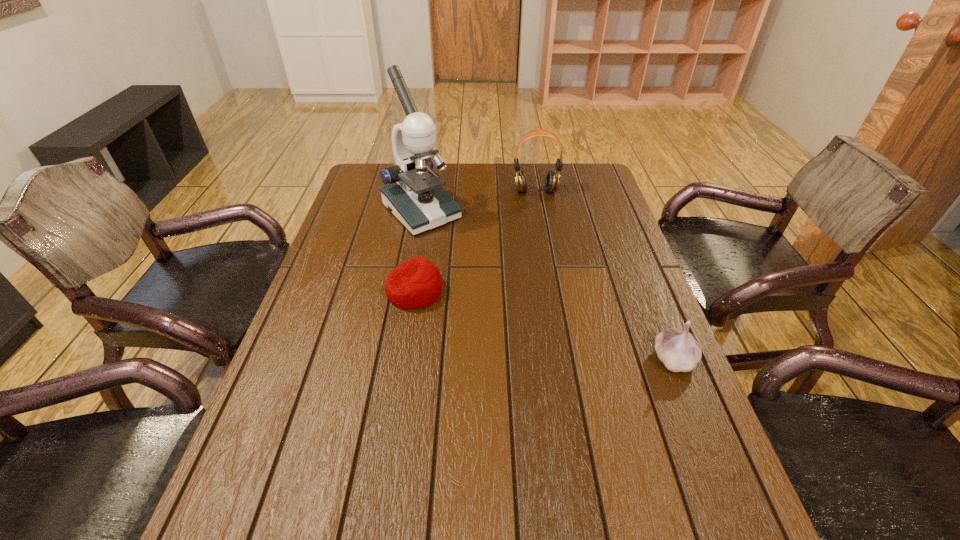
Locate an element on the screen. The height and width of the screenshot is (540, 960). the third farthest object is located at coordinates (416, 283).

Identify the location of the shortest object. The height and width of the screenshot is (540, 960). (416, 283).

Where is `the second shortest object`? The height and width of the screenshot is (540, 960). the second shortest object is located at coordinates (678, 350).

This screenshot has width=960, height=540. I want to click on the rightmost object, so click(x=678, y=350).

The width and height of the screenshot is (960, 540). I want to click on the tallest object, so click(415, 196).

Image resolution: width=960 pixels, height=540 pixels. In order to click on headset in this screenshot , I will do `click(552, 180)`.

Image resolution: width=960 pixels, height=540 pixels. Identify the location of the second tallest object. (552, 180).

Identify the location of vacant space positioned 0.090m on the seat area of the beanbag. The image size is (960, 540). (352, 291).

Where is `free location located 0.330m on the left of the garlic`? This screenshot has width=960, height=540. free location located 0.330m on the left of the garlic is located at coordinates (508, 359).

Where is `vacant space located 0.370m at the eyepiece of the tallest object`? This screenshot has height=540, width=960. vacant space located 0.370m at the eyepiece of the tallest object is located at coordinates (515, 303).